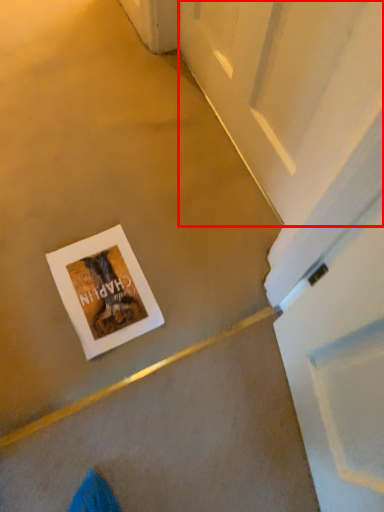
Question: Observing the image, what is the correct spatial positioning of screen door (annotated by the red box) in reference to postcard?

Choices:
 (A) right
 (B) left

Answer: (A)